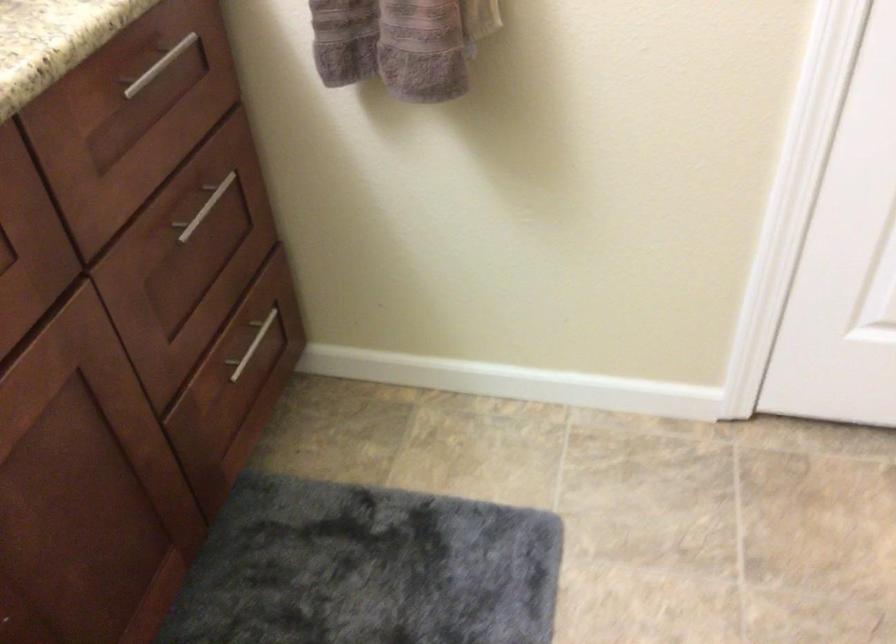
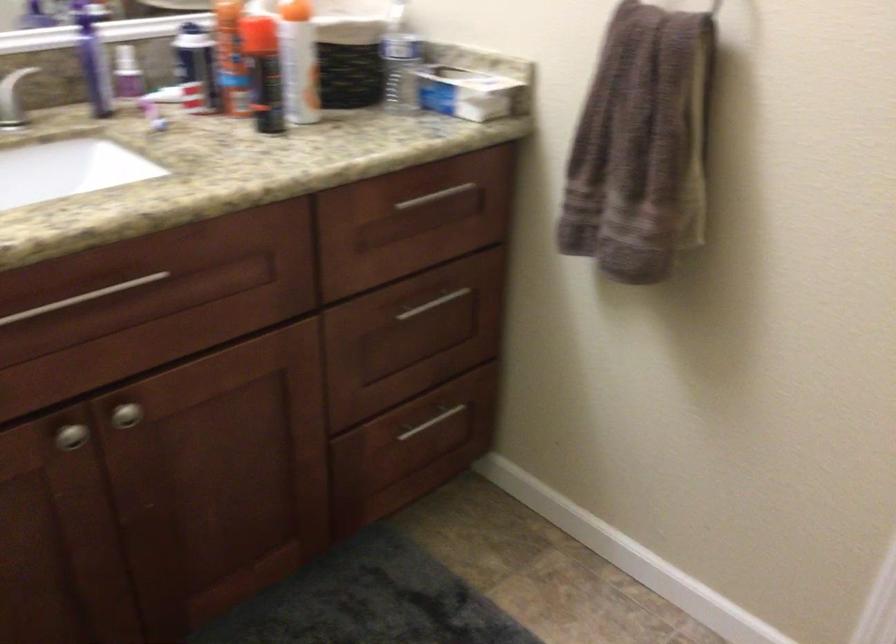
The point at (211, 207) is marked in the first image. Where is the corresponding point in the second image?

(434, 304)